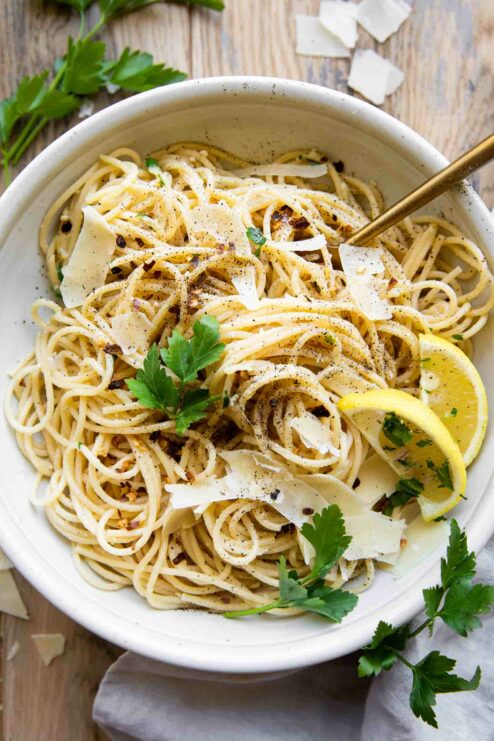
Find the location of a particular element. The width and height of the screenshot is (494, 741). napkin is located at coordinates (277, 707).